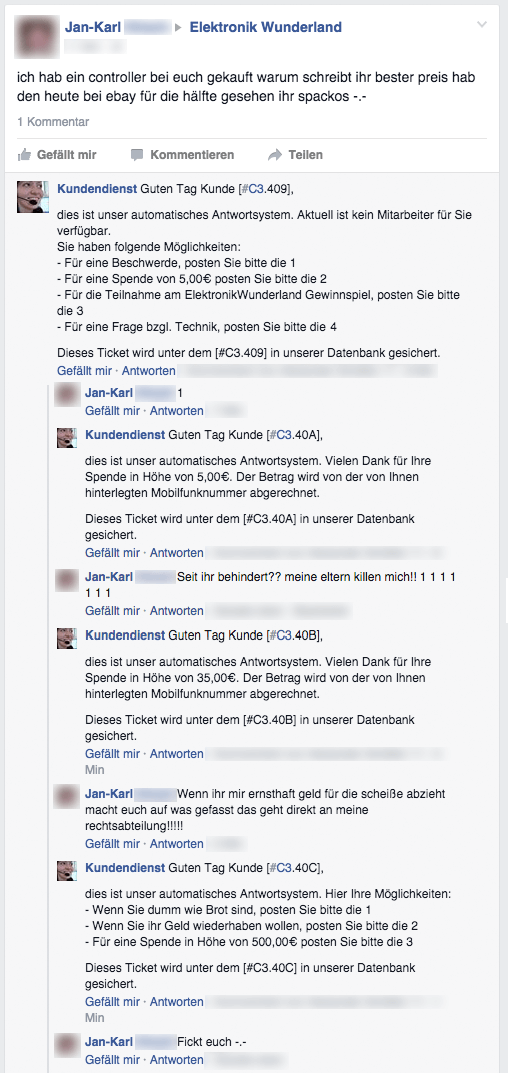
The width and height of the screenshot is (508, 1073). Identify the location of pictures. pyautogui.click(x=72, y=1047), pyautogui.click(x=63, y=870), pyautogui.click(x=68, y=796), pyautogui.click(x=68, y=640), pyautogui.click(x=71, y=580), pyautogui.click(x=63, y=437), pyautogui.click(x=65, y=395), pyautogui.click(x=31, y=194), pyautogui.click(x=33, y=32).